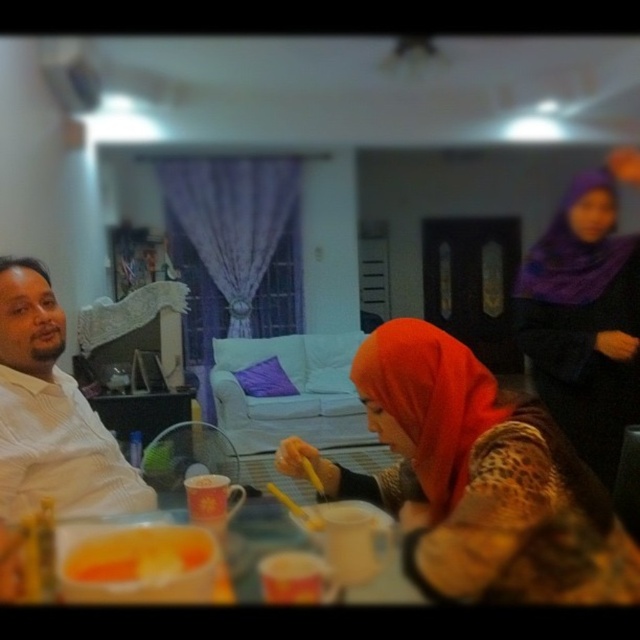
Question: Among these objects, which one is farthest from the camera?

Choices:
 (A) matte orange hijab at center
 (B) white plastic table at lower center
 (C) purple satin hijab at upper right
 (D) white textured shirt at left

Answer: (C)

Question: Is purple satin hijab at upper right closer to camera compared to white plastic table at lower center?

Choices:
 (A) no
 (B) yes

Answer: (A)

Question: From the image, what is the correct spatial relationship of white textured shirt at left in relation to yellow matte food at lower left?

Choices:
 (A) right
 (B) left

Answer: (B)

Question: Among these points, which one is farthest from the camera?

Choices:
 (A) (20, 268)
 (B) (257, 556)

Answer: (A)

Question: Is matte orange hijab at center closer to camera compared to yellow matte food at lower left?

Choices:
 (A) no
 (B) yes

Answer: (A)

Question: Which object is closer to the camera taking this photo?

Choices:
 (A) matte orange hijab at center
 (B) white textured shirt at left

Answer: (A)